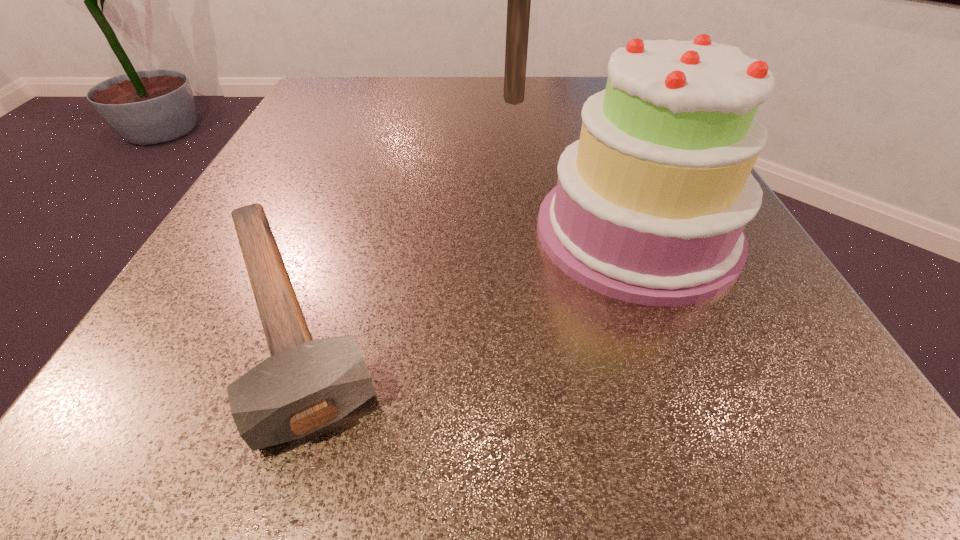
At what (x,y) coordinates should I click in order to perform the action: click on the tallest object. Please return your answer as a coordinate pair (x, y). Looking at the image, I should click on (519, 0).

The width and height of the screenshot is (960, 540). I want to click on the farther mallet, so click(x=519, y=0).

You are a GUI agent. You are given a task and a screenshot of the screen. Output one action in this format:
    pyautogui.click(x=<x>, y=<y>)
    Task: Click on the cake
    
    Given the screenshot: What is the action you would take?
    pyautogui.click(x=650, y=205)

This screenshot has width=960, height=540. I want to click on the shortest object, so click(x=305, y=385).

Image resolution: width=960 pixels, height=540 pixels. I want to click on the left mallet, so click(305, 385).

At what (x,y) coordinates should I click in order to perform the action: click on vacant area situated 0.330m on the front of the tallest object. Please return your answer as a coordinate pair (x, y). Looking at the image, I should click on (529, 221).

Locate an element on the screen. This screenshot has width=960, height=540. blank space located on the back of the second tallest object is located at coordinates (607, 157).

Identify the location of blank area located on the right of the leftmost object. point(468,315).

At what (x,y) coordinates should I click in order to perform the action: click on object that is at the far edge. Please return your answer as a coordinate pair (x, y). Image resolution: width=960 pixels, height=540 pixels. Looking at the image, I should click on (519, 0).

In order to click on object that is at the near edge in this screenshot , I will do `click(305, 385)`.